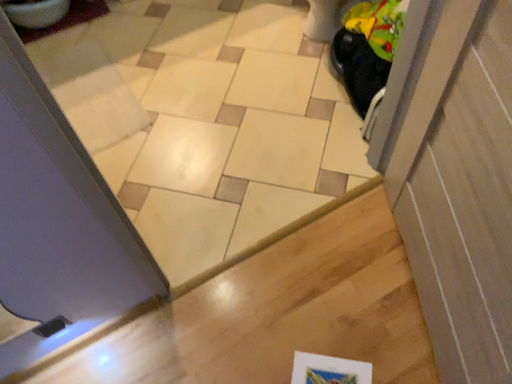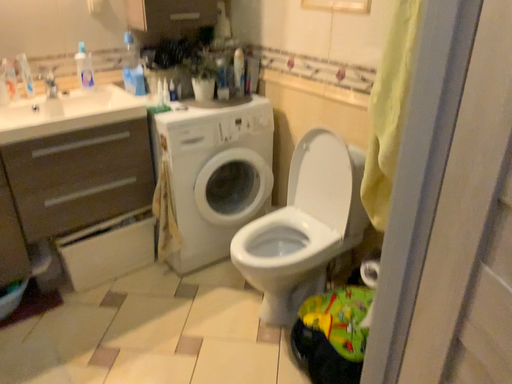
Question: Which way did the camera rotate in the video?

Choices:
 (A) rotated downward
 (B) rotated upward

Answer: (B)